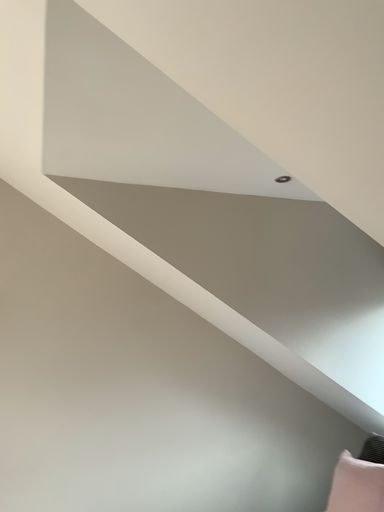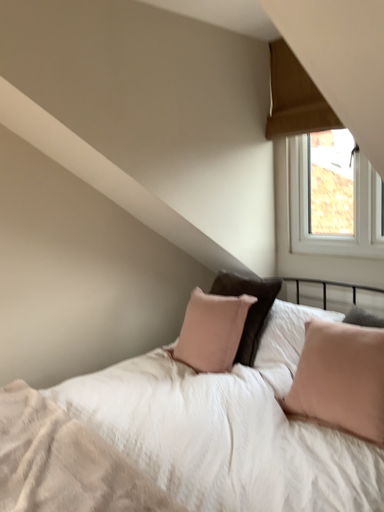
Question: Which way did the camera rotate in the video?

Choices:
 (A) rotated upward
 (B) rotated downward

Answer: (B)